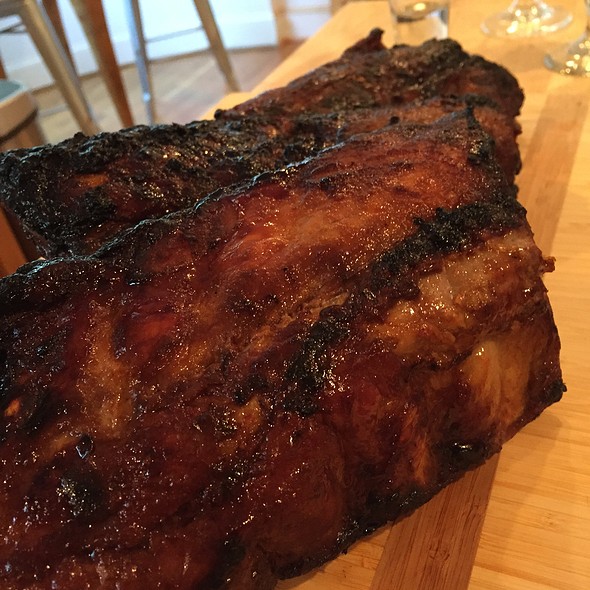
I want to click on wine glass, so click(533, 18), click(571, 65).